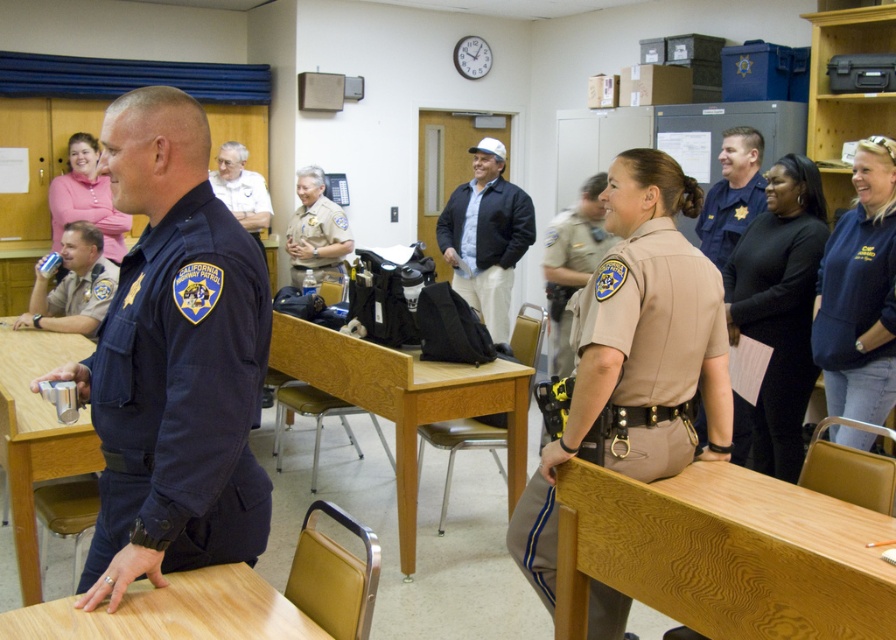
Question: Is navy blue uniform at center in front of black leather jacket at center?

Choices:
 (A) no
 (B) yes

Answer: (B)

Question: Does wooden table at lower left appear under matte black uniform at left?

Choices:
 (A) yes
 (B) no

Answer: (A)

Question: Which of the following is the farthest from the observer?

Choices:
 (A) (790, 388)
 (B) (868, 630)
 (C) (531, 480)
 (D) (123, 260)

Answer: (A)

Question: Which object is positioned closest to the black matte shirt at center?

Choices:
 (A) navy blue fleece sweatshirt at right
 (B) matte black uniform at left
 (C) dark blue uniform at center

Answer: (A)

Question: Estimate the real-world distances between objects in this image. Which object is farther from the brown leather jacket at upper right?

Choices:
 (A) wooden table at lower left
 (B) wooden table at center
 (C) black matte shirt at center

Answer: (A)

Question: Does brown leather jacket at upper right appear under matte black uniform at left?

Choices:
 (A) no
 (B) yes

Answer: (A)